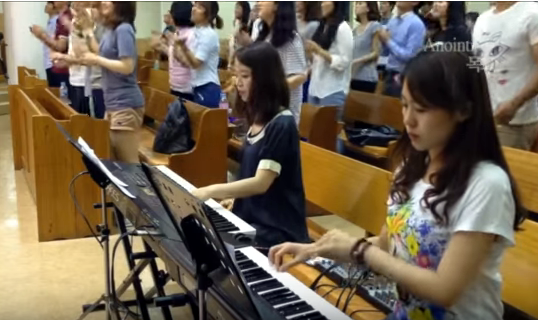
Identify the location of back wall. (28, 12).